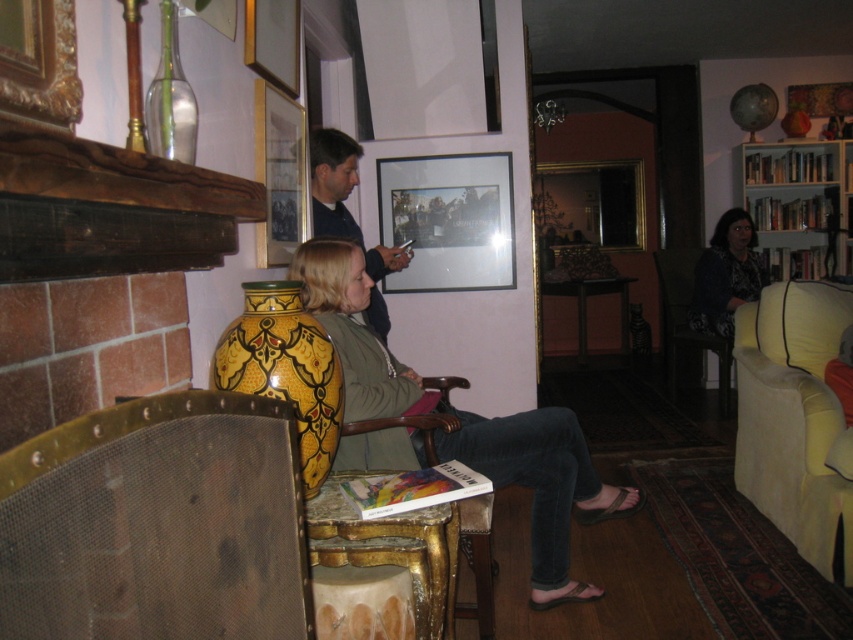
You are organizing a clothing display in a store and need to arrange the matte black shirt at center and the dark floral dress at right based on their sizes. Which clothing item should you place on the lower shelf if the lower shelf is meant for smaller items?

The matte black shirt at center is smaller than the dark floral dress at right, so it should be placed on the lower shelf designated for smaller items.

Consider the image. You are sitting in the velvet dark blue armchair at right and want to pick up the matte glass picture frame at center. Can you reach it without moving from your seat?

The matte glass picture frame at center is closer to the viewer than the velvet dark blue armchair at right, so yes, you can reach it from the velvet dark blue armchair at right since it is within arm reach.

You are sitting in the velvet dark blue armchair at right and want to look at the matte glass picture frame at center. Can you see it without moving your head?

The matte glass picture frame at center is positioned over the velvet dark blue armchair at right, so yes, you can see it without moving your head.